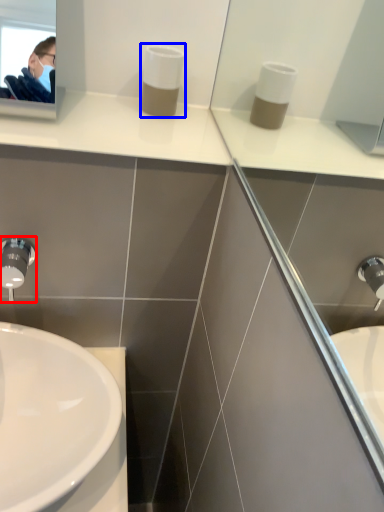
Question: Which of the following is the farthest to the observer, tap (highlighted by a red box) or soap dispenser (highlighted by a blue box)?

Choices:
 (A) tap
 (B) soap dispenser

Answer: (B)